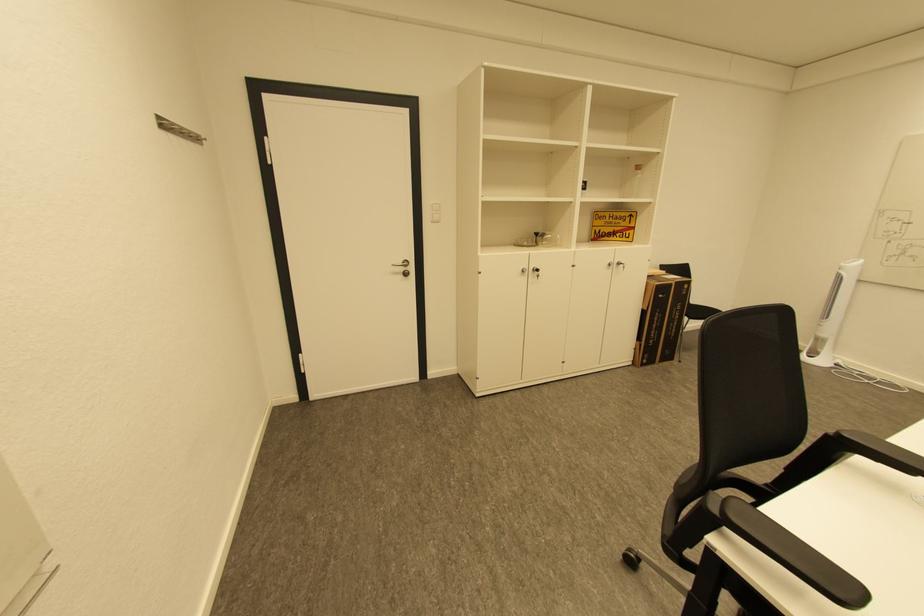
The image size is (924, 616). Describe the element at coordinates (403, 267) in the screenshot. I see `the silver door handle` at that location.